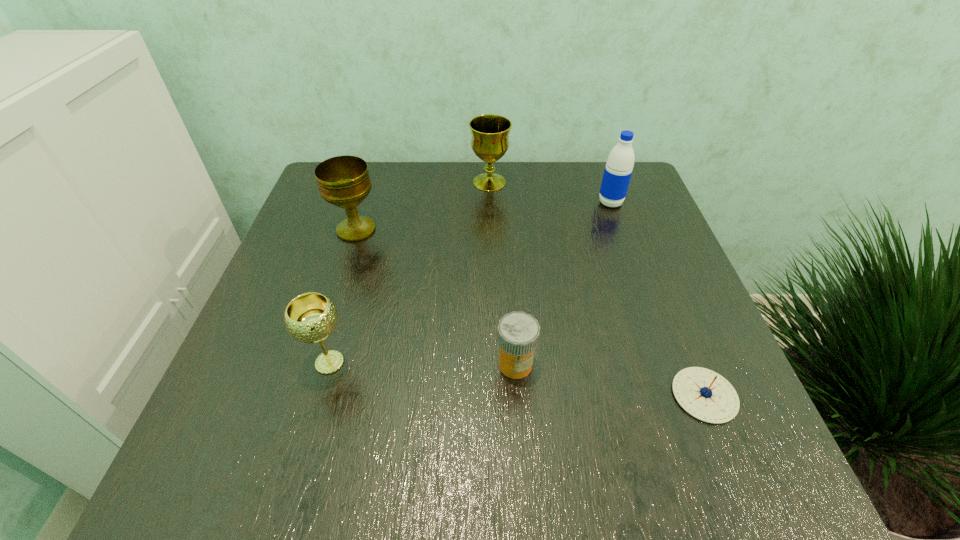
You are a GUI agent. You are given a task and a screenshot of the screen. Output one action in this format:
    pyautogui.click(x=<x>, y=<y>)
    Task: Click on the water bottle
    Image resolution: width=960 pixels, height=540 pixels.
    Given the screenshot: What is the action you would take?
    pyautogui.click(x=619, y=166)

You are a GUI agent. You are given a task and a screenshot of the screen. Output one action in this format:
    pyautogui.click(x=<x>, y=<y>)
    Task: Click on the farthest object
    The width and height of the screenshot is (960, 540).
    Given the screenshot: What is the action you would take?
    pyautogui.click(x=490, y=141)

Where is `the farthest chalice`? The image size is (960, 540). the farthest chalice is located at coordinates (490, 141).

Find the location of a particular element. the third farthest object is located at coordinates tap(343, 181).

Find the location of a particular element. The height and width of the screenshot is (540, 960). the nearest chalice is located at coordinates (311, 317).

Find the location of a particular element. medicine is located at coordinates (518, 332).

Identify the location of compass. (704, 394).

Locate an element on the screen. free spot located 0.150m on the left of the fifth nearest object is located at coordinates (538, 202).

At what (x,y) coordinates should I click in order to perform the action: click on vacant area situated 0.190m on the front of the farthest chalice. Please return your answer as a coordinate pair (x, y). Looking at the image, I should click on (491, 241).

The image size is (960, 540). Identify the location of vacant space located 0.300m on the front of the fourth nearest object. (316, 356).